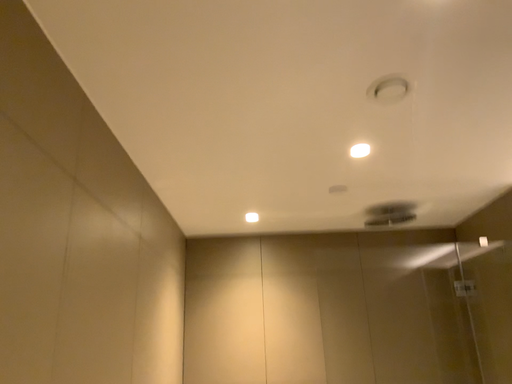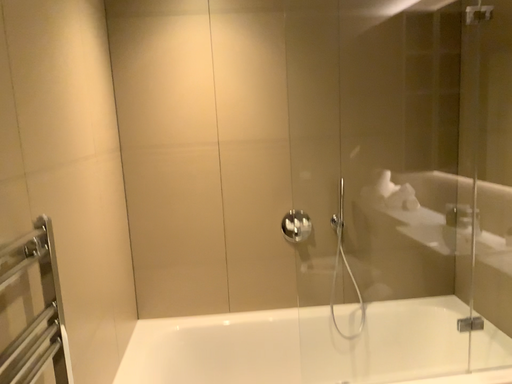
Question: How did the camera likely rotate when shooting the video?

Choices:
 (A) rotated upward
 (B) rotated downward

Answer: (B)